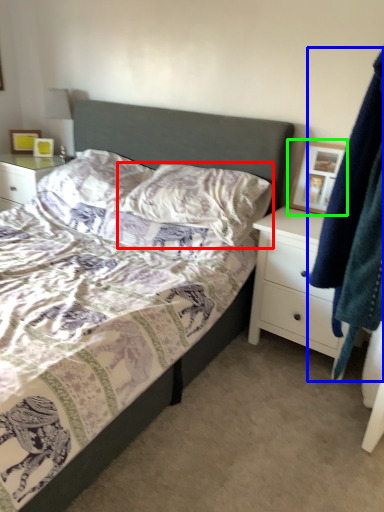
Question: Which object is the farthest from pillow (highlighted by a red box)? Choose among these: clothing (highlighted by a blue box) or picture frame (highlighted by a green box).

Choices:
 (A) clothing
 (B) picture frame

Answer: (A)